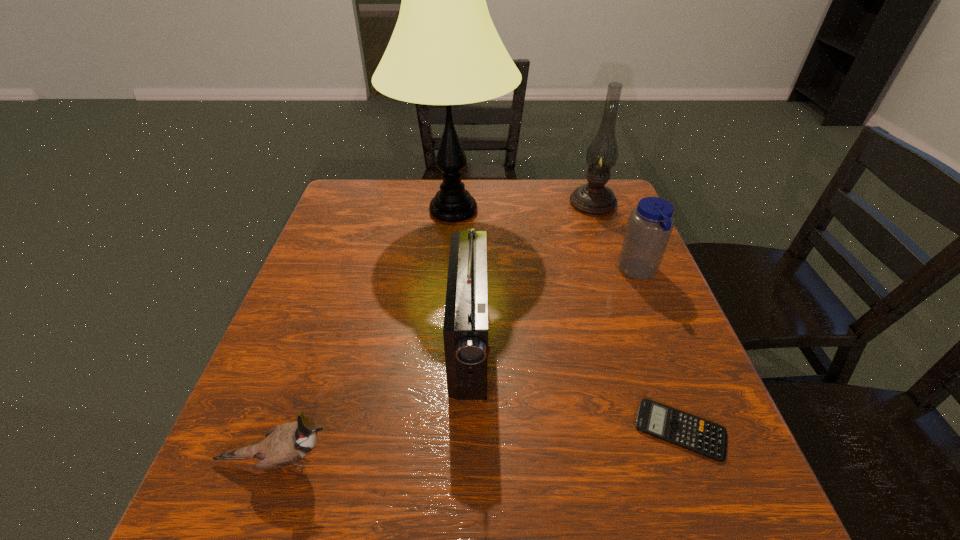
In order to click on water bottle located at the right edge in this screenshot , I will do `click(650, 224)`.

Image resolution: width=960 pixels, height=540 pixels. In order to click on calculator positioned at the right edge in this screenshot , I will do `click(693, 433)`.

At what (x,y) coordinates should I click in order to perform the action: click on object that is at the near left corner. Please return your answer as a coordinate pair (x, y). Looking at the image, I should click on (285, 444).

Identify the location of object present at the far right corner. (594, 198).

Find the location of a particular element. The height and width of the screenshot is (540, 960). free space at the far edge of the desktop is located at coordinates (534, 190).

You are a GUI agent. You are given a task and a screenshot of the screen. Output one action in this format:
    pyautogui.click(x=<x>, y=<y>)
    Task: Click on the vacant space at the near edge
    This screenshot has width=960, height=540.
    Given the screenshot: What is the action you would take?
    pyautogui.click(x=382, y=493)

In order to click on free spot at the left edge of the desktop in this screenshot , I will do `click(348, 346)`.

In the image, there is a desktop. Where is `free space at the right edge`? This screenshot has width=960, height=540. free space at the right edge is located at coordinates (618, 233).

The width and height of the screenshot is (960, 540). In the image, there is a desktop. Identify the location of vacant space at the near left corner. (259, 512).

Where is `free space at the far right corner of the desktop`? This screenshot has width=960, height=540. free space at the far right corner of the desktop is located at coordinates (599, 221).